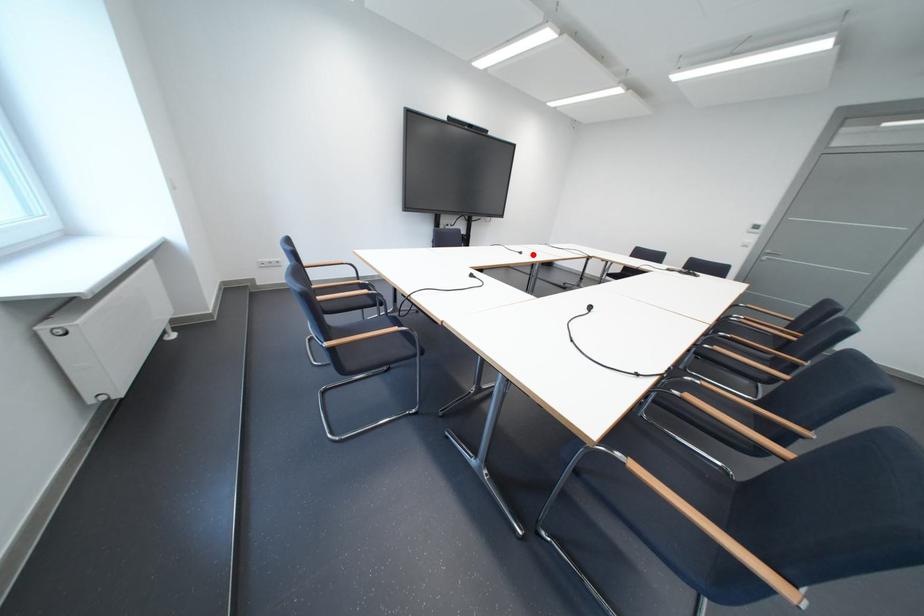
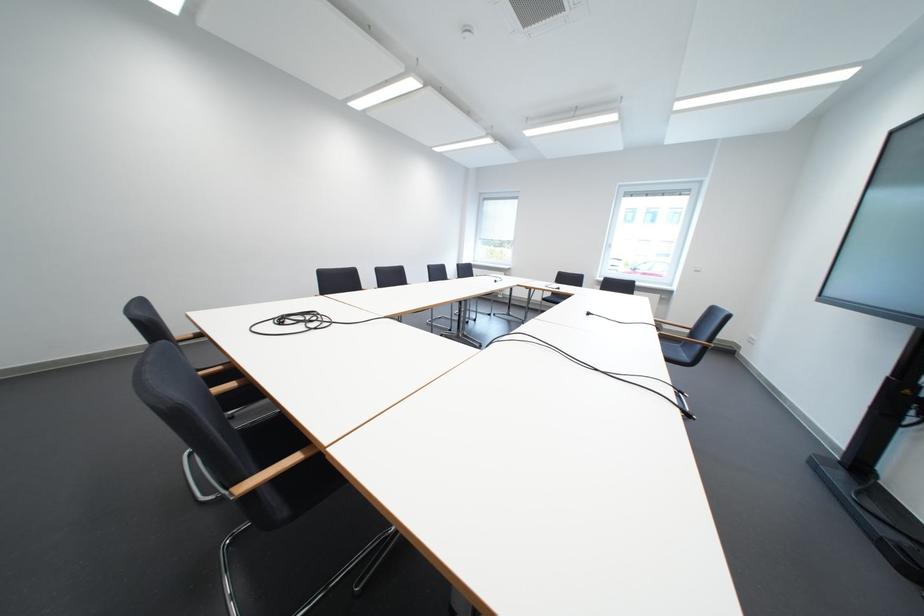
Question: I am providing you with two images of the same scene from different viewpoints. A red point is marked on the first image. Can you still see the location of the red point in image 2?

Choices:
 (A) Yes
 (B) No

Answer: (A)